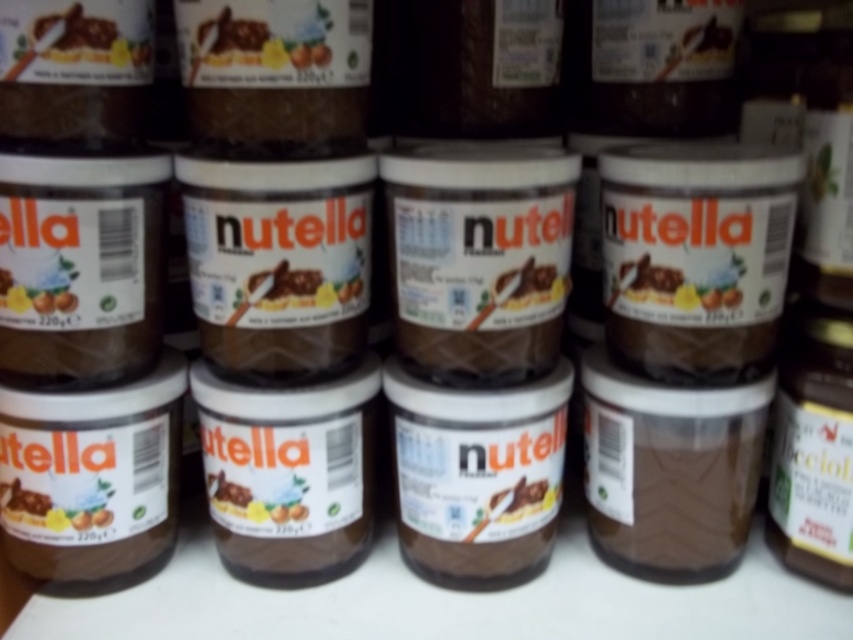
Question: Which point is farther to the camera?

Choices:
 (A) (57, 308)
 (B) (9, 497)
 (C) (721, 282)

Answer: (B)

Question: Does matte brown jar at center lie in front of matte brown jar at left?

Choices:
 (A) no
 (B) yes

Answer: (A)

Question: Can you confirm if matte chocolate spread at center is bigger than matte brown jar at center?

Choices:
 (A) no
 (B) yes

Answer: (B)

Question: Does matte chocolate spread at center come behind matte brown jar at center?

Choices:
 (A) no
 (B) yes

Answer: (A)

Question: Which of the following is the farthest from the observer?

Choices:
 (A) matte chocolate spread at center
 (B) matte brown jar at left
 (C) matte brown jar at center

Answer: (C)

Question: Which of the following is the farthest from the observer?

Choices:
 (A) (705, 289)
 (B) (22, 499)
 (C) (65, 305)

Answer: (B)